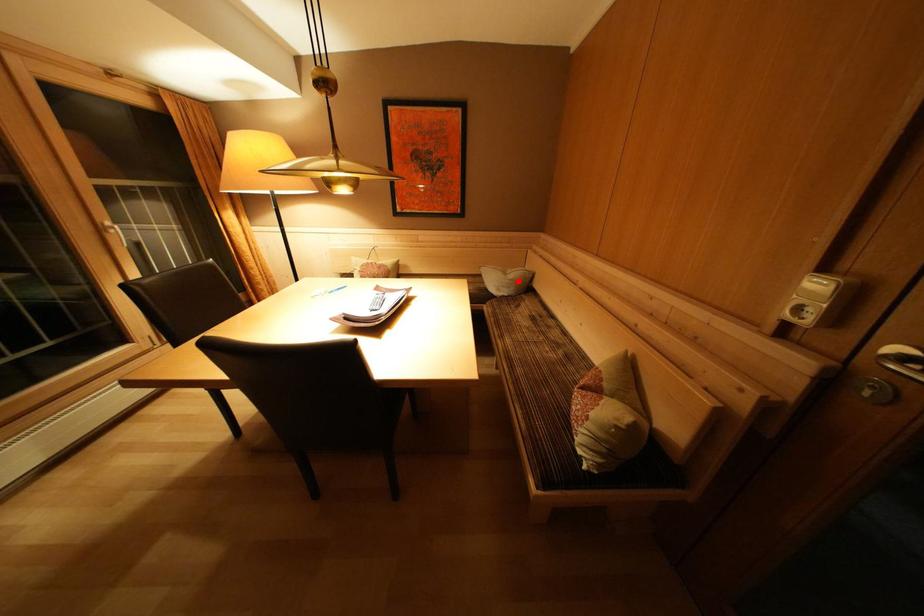
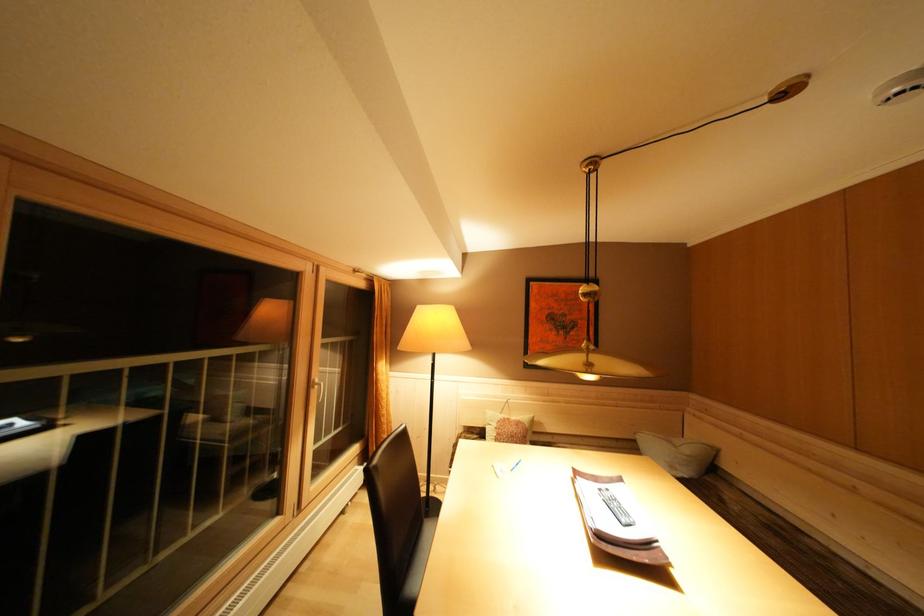
Where in the second image is the point corresponding to the highlighted location from the first image?

(695, 456)